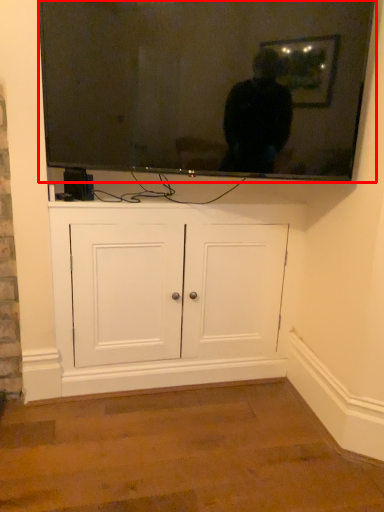
Question: Observing the image, what is the correct spatial positioning of television (annotated by the red box) in reference to cabinetry?

Choices:
 (A) right
 (B) left

Answer: (A)